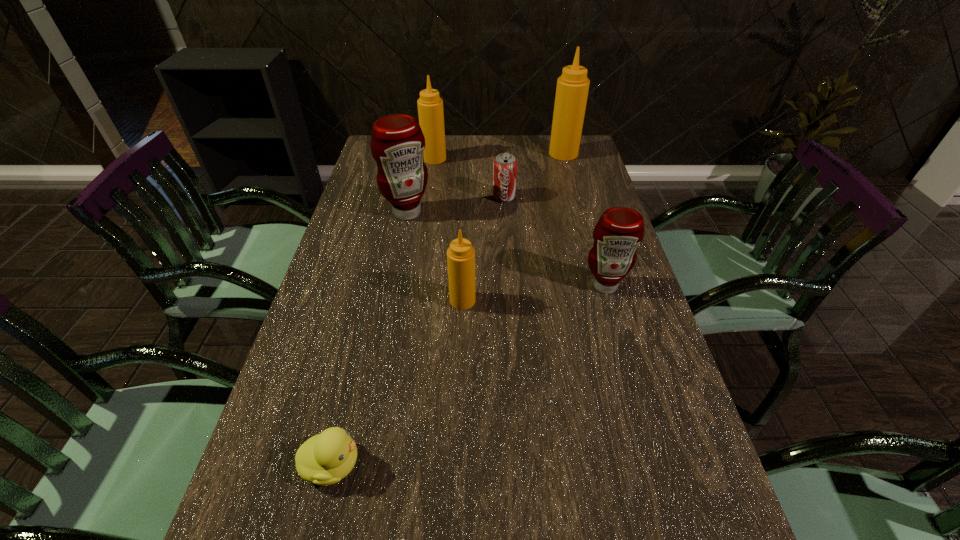
Find the location of a particular element. The image size is (960, 540). the tallest condiment is located at coordinates (572, 88).

You are a GUI agent. You are given a task and a screenshot of the screen. Output one action in this format:
    pyautogui.click(x=<x>, y=<y>)
    Task: Click on the tallest object
    This screenshot has width=960, height=540.
    Given the screenshot: What is the action you would take?
    pyautogui.click(x=572, y=88)

Where is `the second smallest tan condiment`? the second smallest tan condiment is located at coordinates (430, 106).

Find the location of a particular element. The width and height of the screenshot is (960, 540). the left red condiment is located at coordinates coord(397,143).

Locate an element on the screen. This screenshot has height=540, width=960. the bigger red condiment is located at coordinates (397, 143).

Locate an element on the screen. the third condiment from right to left is located at coordinates (460, 255).

Locate an element on the screen. the smallest tan condiment is located at coordinates coord(460,255).

Locate an element on the screen. This screenshot has width=960, height=540. the right red condiment is located at coordinates (618, 232).

You are a GUI agent. You are given a task and a screenshot of the screen. Output one action in this format:
    pyautogui.click(x=<x>, y=<y>)
    Task: Click on the nearer red condiment
    
    Given the screenshot: What is the action you would take?
    pyautogui.click(x=618, y=232)

Locate an element on the screen. The image size is (960, 540). the third object from right to left is located at coordinates (505, 165).